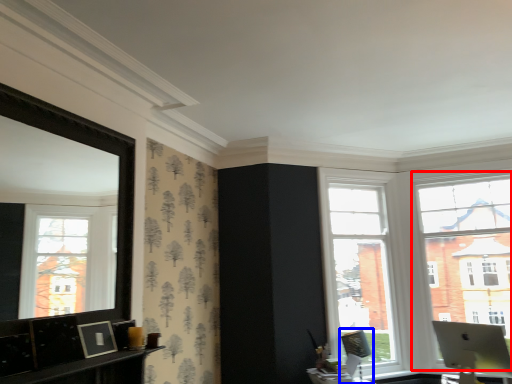
Question: Which object is further to the camera taking this photo, window (highlighted by a red box) or swivel chair (highlighted by a blue box)?

Choices:
 (A) window
 (B) swivel chair

Answer: (A)